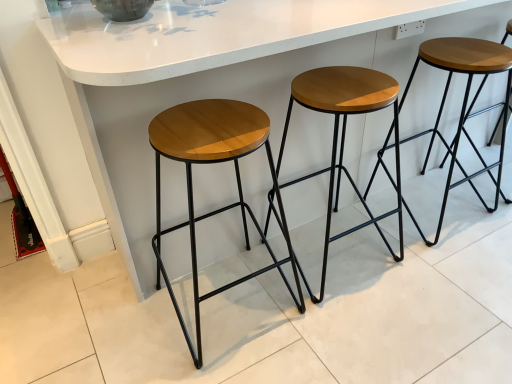
You are a GUI agent. You are given a task and a screenshot of the screen. Output one action in this format:
    pyautogui.click(x=<x>, y=<y>)
    Task: Click on the empty space that is ontop of wooden/matte stool at center, acting as the second stool starting from the right (from a real-world perspective)
    The width and height of the screenshot is (512, 384).
    Given the screenshot: What is the action you would take?
    pyautogui.click(x=348, y=91)